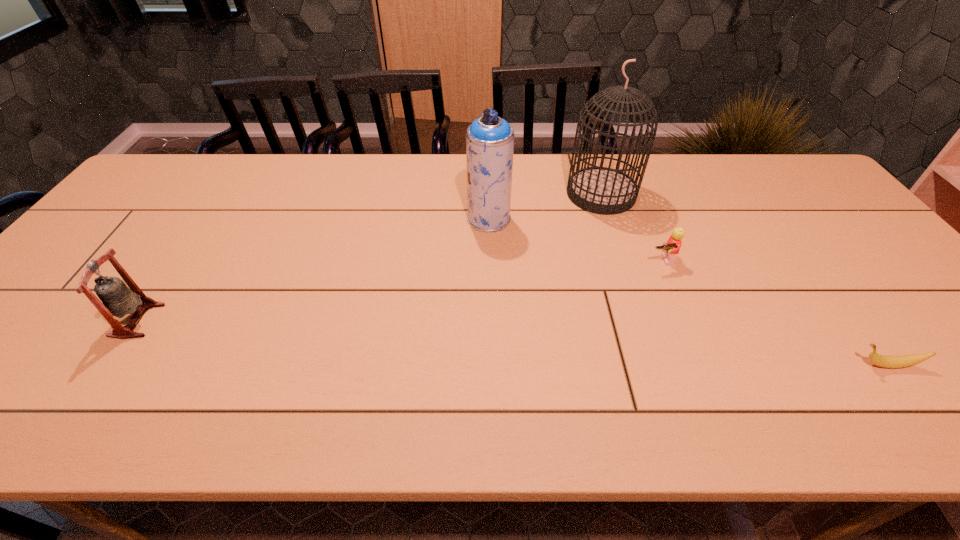
In order to click on vacant space at the right edge of the desktop in this screenshot , I will do `click(892, 310)`.

Where is `vacant space at the far left corner of the desktop`? Image resolution: width=960 pixels, height=540 pixels. vacant space at the far left corner of the desktop is located at coordinates (185, 195).

Find the location of a particular element. blank space at the far right corner is located at coordinates point(774,180).

The width and height of the screenshot is (960, 540). What are the coordinates of `free space between the tallest object and the bell` in the screenshot? It's located at pos(370,257).

Locate an element on the screen. Image resolution: width=960 pixels, height=540 pixels. free space between the aerosol can and the tallest object is located at coordinates (545, 206).

At what (x,y) coordinates should I click in order to perform the action: click on unoccupied area between the leftmost object and the tallest object. Please return your answer as a coordinate pair (x, y). This screenshot has height=540, width=960. Looking at the image, I should click on (370, 257).

I want to click on free space between the aerosol can and the third tallest object, so click(313, 269).

Identify the location of free space between the banana and the Lego. This screenshot has width=960, height=540. coord(774,313).

Where is `free space between the second shortest object and the leftmost object`? The image size is (960, 540). free space between the second shortest object and the leftmost object is located at coordinates (399, 290).

Find the location of a particular element. The width and height of the screenshot is (960, 540). vacant space in between the rightmost object and the leftmost object is located at coordinates (512, 342).